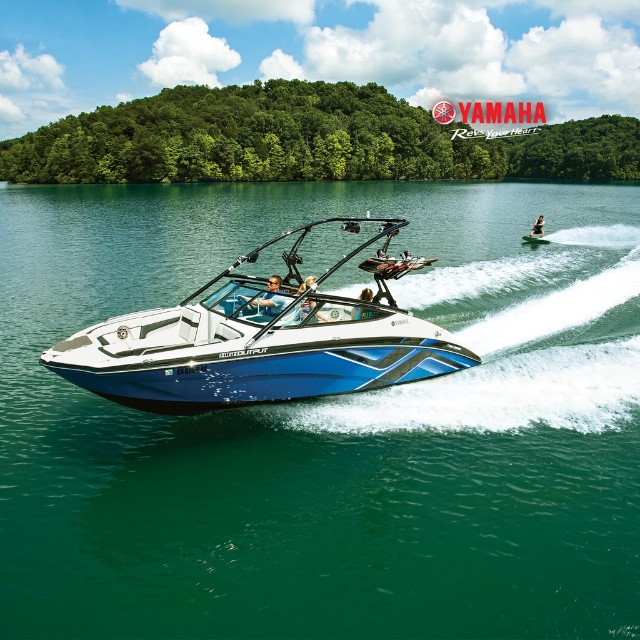
Question: Which point is farther to the camera?

Choices:
 (A) blue matte boat at center
 (B) blue glossy wakeboard boat at center

Answer: (A)

Question: Estimate the real-world distances between objects in this image. Which object is closer to the blue matte boat at center?

Choices:
 (A) matte black sunglasses at center
 (B) blue glossy water at center
 (C) blue glossy water skier at center

Answer: (A)

Question: Is matte black sunglasses at center to the right of blue glossy water skier at center from the viewer's perspective?

Choices:
 (A) no
 (B) yes

Answer: (A)

Question: Does blue matte boat at center have a lesser width compared to blue glossy water skier at center?

Choices:
 (A) no
 (B) yes

Answer: (B)

Question: Does blue glossy water at center have a smaller size compared to metallic blue helmet at center?

Choices:
 (A) yes
 (B) no

Answer: (B)

Question: Which point is closer to the camera?

Choices:
 (A) matte black sunglasses at center
 (B) blue matte boat at center
 (C) metallic blue helmet at center

Answer: (B)